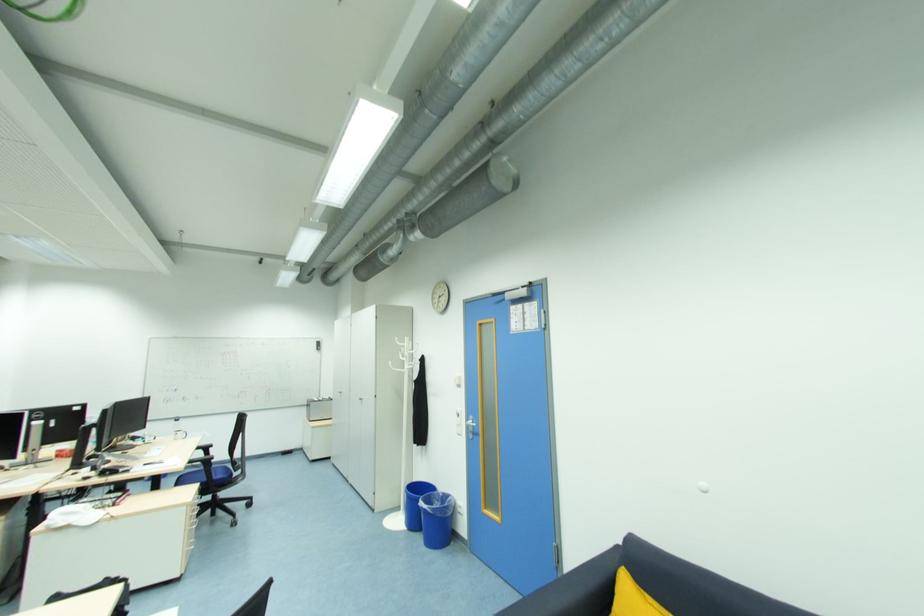
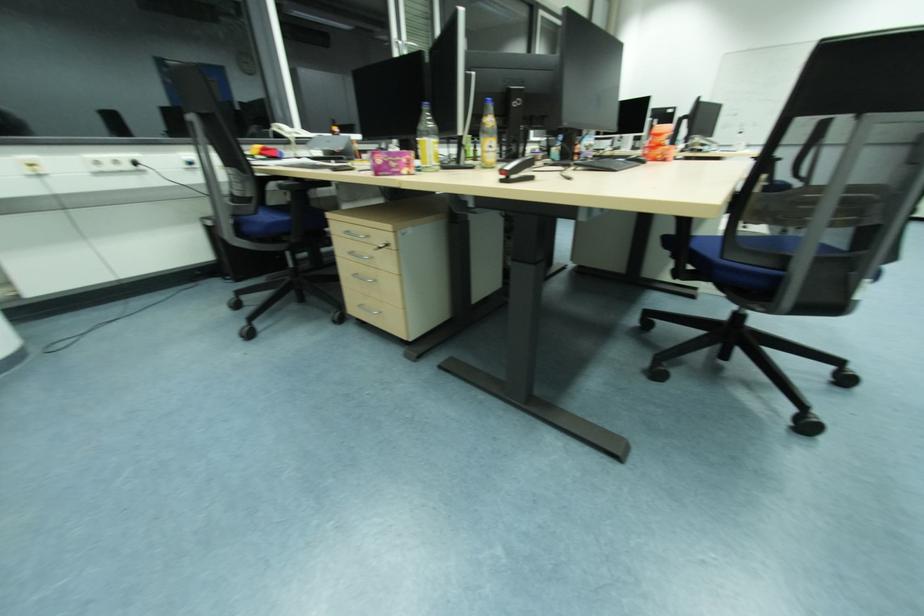
How did the camera likely rotate?

The rotation direction of the camera is left-down.